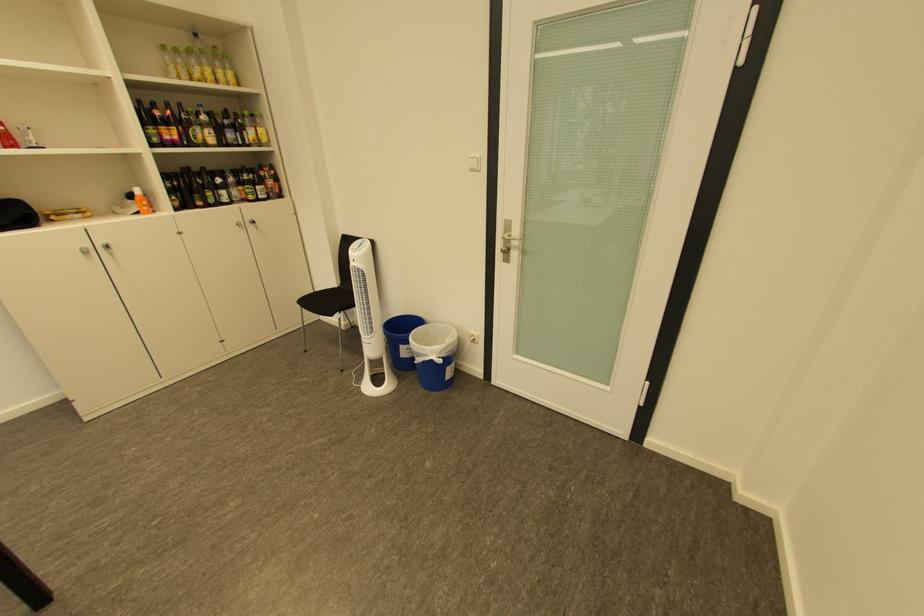
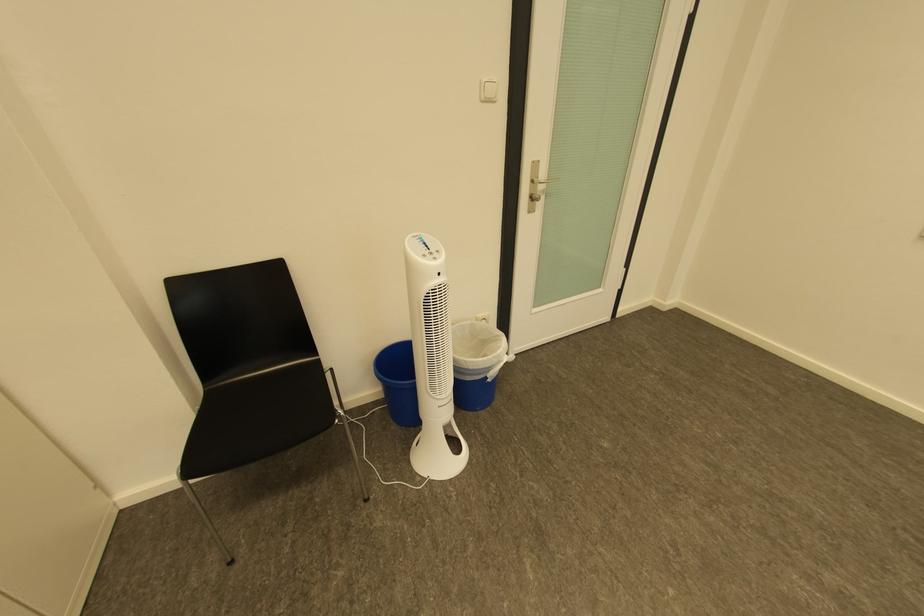
Where in the second image is the point corresponding to [429,355] from the first image?

(499, 370)